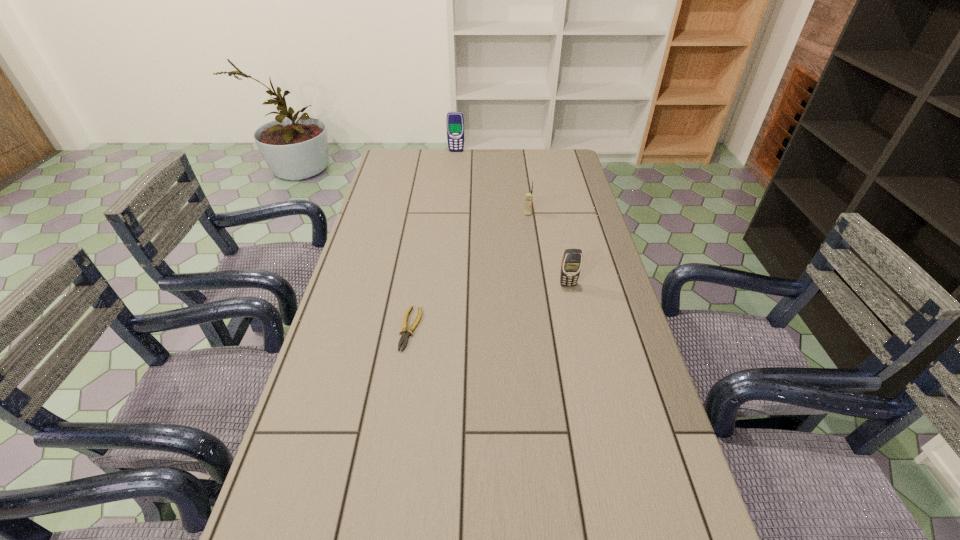
Locate an element on the screen. the tallest object is located at coordinates point(455,121).

Image resolution: width=960 pixels, height=540 pixels. I want to click on the second object from left to right, so (x=455, y=121).

At what (x,y) coordinates should I click in order to perform the action: click on the third nearest object. Please return your answer as a coordinate pair (x, y). The image size is (960, 540). Looking at the image, I should click on (529, 196).

Find the location of a particular element. This screenshot has height=540, width=960. the second cellular telephone from right to left is located at coordinates click(x=529, y=196).

What are the coordinates of `the rightmost object` in the screenshot? It's located at (571, 264).

You are a GUI agent. You are given a task and a screenshot of the screen. Output one action in this format:
    pyautogui.click(x=<x>, y=<y>)
    Task: Click on the nearest cellular telephone
    The width and height of the screenshot is (960, 540).
    Given the screenshot: What is the action you would take?
    pyautogui.click(x=571, y=264)

The height and width of the screenshot is (540, 960). What are the coordinates of `pliers` in the screenshot? It's located at (405, 333).

The image size is (960, 540). Identify the location of the shortest object. (405, 333).

Where is `free space located 0.200m on the front-facing side of the second object from left to right`? free space located 0.200m on the front-facing side of the second object from left to right is located at coordinates (454, 176).

At what (x,y) coordinates should I click in order to perform the action: click on vacant space located on the front of the second cellular telephone from left to right, where the keypad is located. Please return your answer as a coordinate pair (x, y). Looking at the image, I should click on (538, 286).